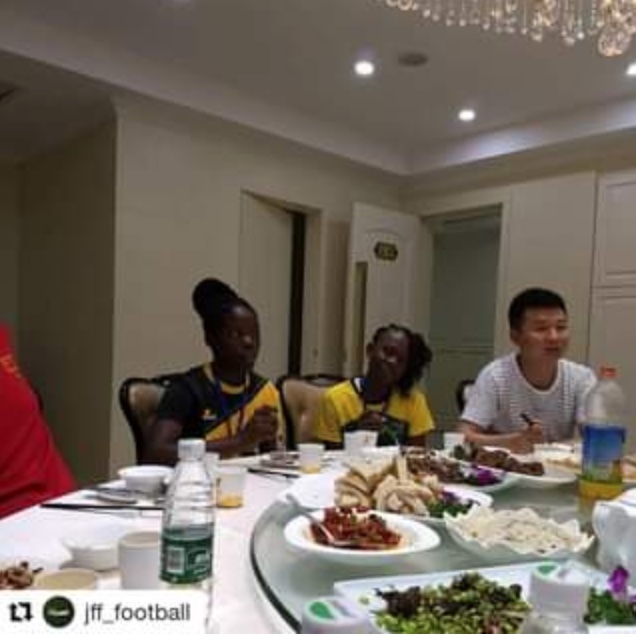
Identify the location of wall. This screenshot has width=636, height=638. (516, 271), (165, 256).